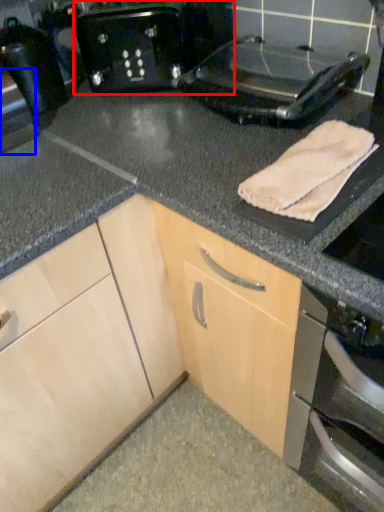
Question: Which object appears farthest to the camera in this image, toaster (highlighted by a red box) or appliance (highlighted by a blue box)?

Choices:
 (A) toaster
 (B) appliance

Answer: (A)